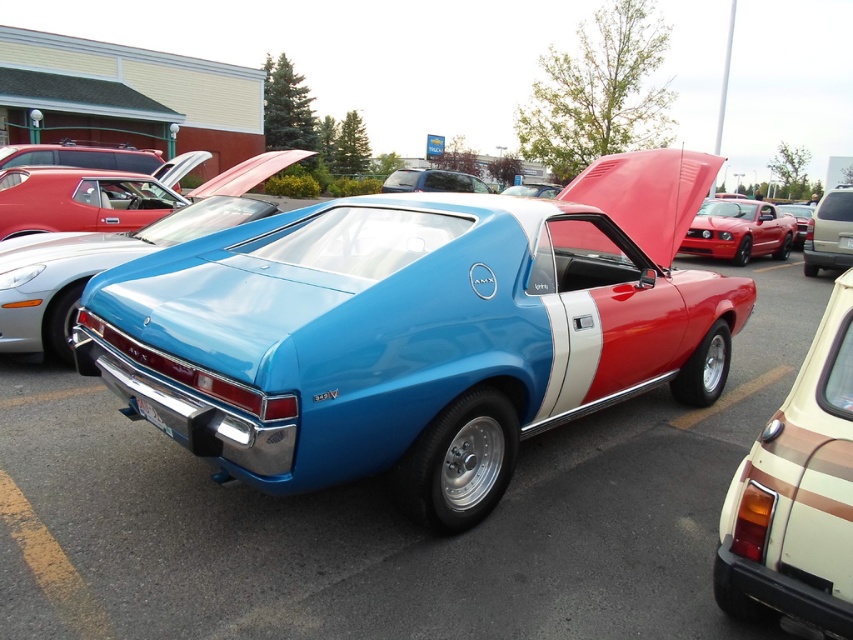
Does shiny red car at right lie in front of white plastic license plate at lower center?

No.

Which of these two, shiny red car at right or white plastic license plate at lower center, stands shorter?

white plastic license plate at lower center is shorter.

Where is `shiny red car at right`? The height and width of the screenshot is (640, 853). shiny red car at right is located at coordinates (738, 230).

Where is `shiny red car at right`? The image size is (853, 640). shiny red car at right is located at coordinates (738, 230).

Is shiny red car at right behind matte silver suv at center?

That is True.

Who is more distant from viewer, (770, 234) or (834, 257)?

Positioned behind is point (770, 234).

Looking at this image, measure the distance between point (756, 228) and camera.

They are 50.07 feet apart.

Locate an element on the screen. The image size is (853, 640). shiny red car at right is located at coordinates (738, 230).

Between glossy metallic car at center and shiny chrome car at center, which one has more height?

Standing taller between the two is shiny chrome car at center.

What do you see at coordinates (384, 520) in the screenshot? This screenshot has width=853, height=640. I see `glossy metallic car at center` at bounding box center [384, 520].

Where is `glossy metallic car at center`? Image resolution: width=853 pixels, height=640 pixels. glossy metallic car at center is located at coordinates (384, 520).